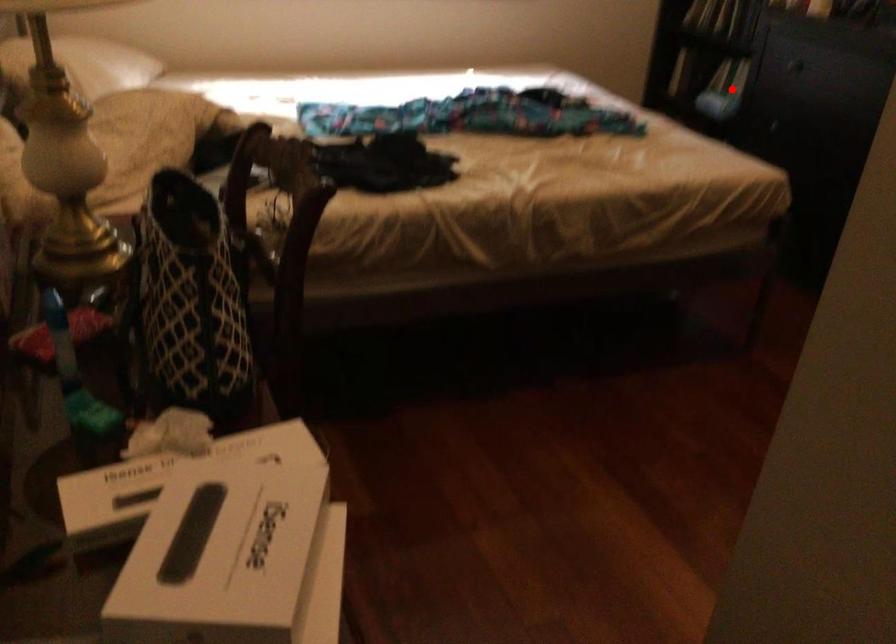
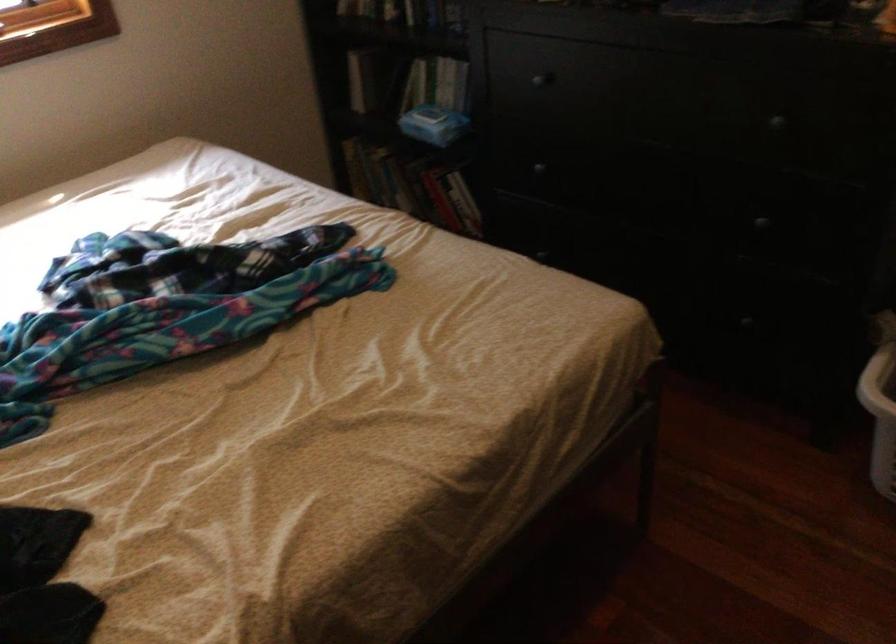
Question: A red point is marked in image1. In image2, is the corresponding 3D point closer to the camera or farther? Reply with the corresponding letter.

Choices:
 (A) The corresponding 3D point is closer.
 (B) The corresponding 3D point is farther.

Answer: (A)